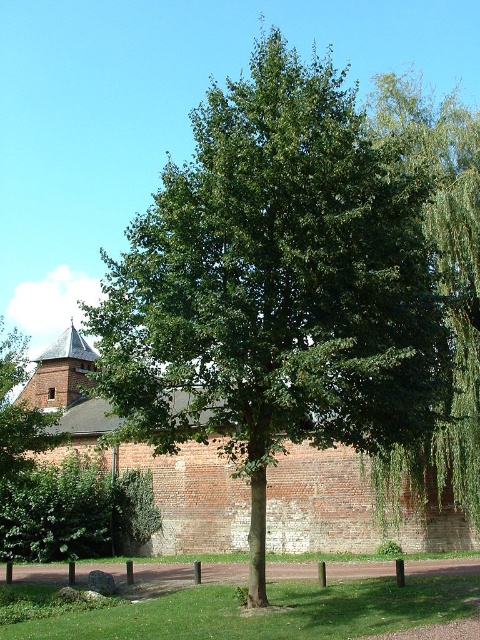
You are a bird looking for a nesting spot. You see the green leafy willow at right and the green leafy tree at upper left. Which tree is taller and would provide a better nesting height?

The green leafy willow at right is taller than the green leafy tree at upper left, so it would provide a better nesting height.

You are a bird looking for a nesting spot. You see the green leafy tree at center and the green leafy tree at upper left. Which tree would provide a higher nesting position?

The green leafy tree at center has a greater height compared to the green leafy tree at upper left, so it would provide a higher nesting position.

You are a landscape architect designing a garden pathway. You need to ensure that the pathway between the green leafy tree at center and the green leafy tree at upper left is wide enough for a 2.5 meter wide truck to pass through. Based on the scene, can the truck pass through the space between these two trees?

The green leafy tree at center might be wider than green leafy tree at upper left, but the description does not provide specific measurements about the distance between them. Without knowing the actual width of the space between the trees, it is impossible to determine if the 2.5 meter wide truck can pass through.